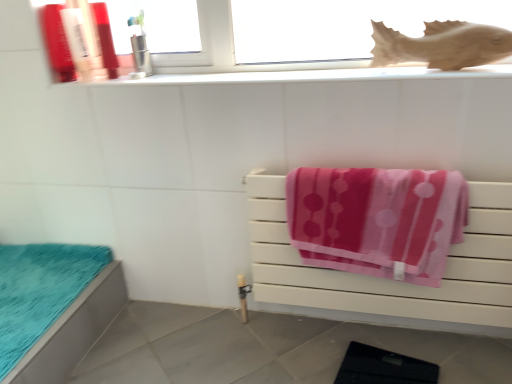
At what (x,y) coordinates should I click in order to perform the action: click on vacant area situated below pink fabric towel at center (from a real-world perspective). Please return your answer as a coordinate pair (x, y). Looking at the image, I should click on (366, 326).